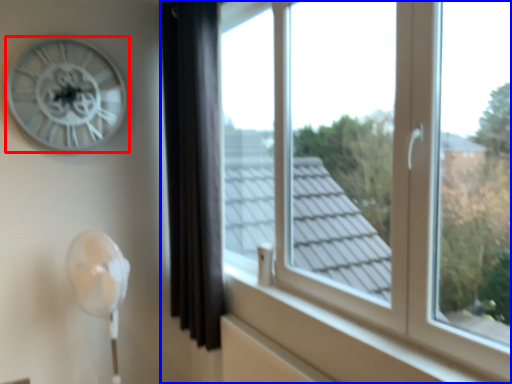
Question: Which object is further to the camera taking this photo, wall clock (highlighted by a red box) or window (highlighted by a blue box)?

Choices:
 (A) wall clock
 (B) window

Answer: (A)